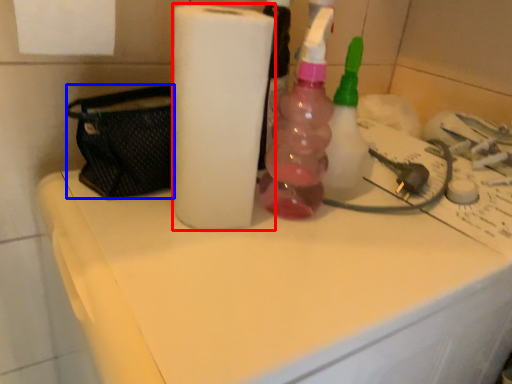
Question: Which object is closer to the camera taking this photo, paper towel (highlighted by a red box) or pouch (highlighted by a blue box)?

Choices:
 (A) paper towel
 (B) pouch

Answer: (A)